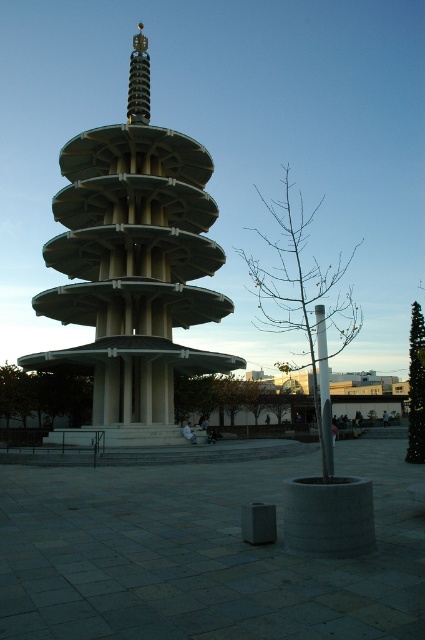
You are standing at the entrance of the plaza facing the pagoda. Which object is positioned to the left when looking at the green concrete tower at center and matte gray pillar at center?

The green concrete tower at center is to the left of the matte gray pillar at center.

You are standing in the plaza looking at the pagoda. There are two objects at the center of the image, the green concrete tower at center and the matte gray pillar at center. Which one is closer to you?

The green concrete tower at center is closer to you because the matte gray pillar at center is behind it.

In the scene shown: You are an architect reviewing a model of a public space. The model includes a green concrete tower at center and a matte gray pillar at center. Based on the model, which object occupies more space in the design?

The green concrete tower at center is bigger than the matte gray pillar at center, so it occupies more space in the design.